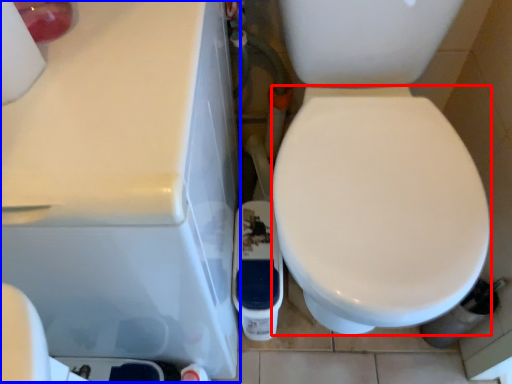
Question: Among these objects, which one is nearest to the camera, bidet (highlighted by a red box) or porcelain (highlighted by a blue box)?

Choices:
 (A) bidet
 (B) porcelain

Answer: (A)